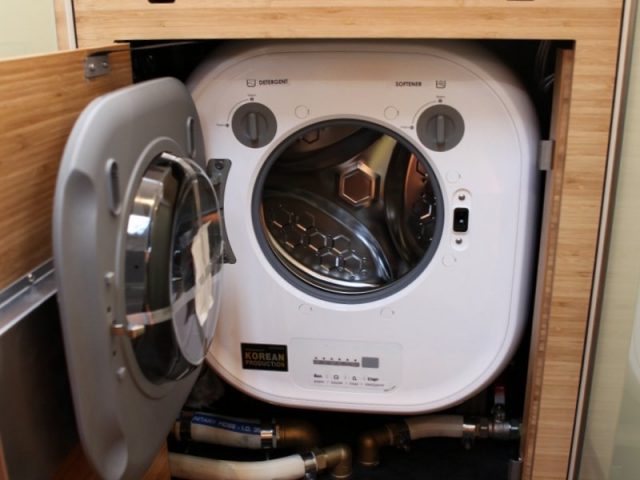
Locate an element on the screen. The height and width of the screenshot is (480, 640). wooden structure that holds washing machine is located at coordinates (x=559, y=302), (x=447, y=21), (x=52, y=86), (x=146, y=11), (x=288, y=18), (x=563, y=422), (x=13, y=223).